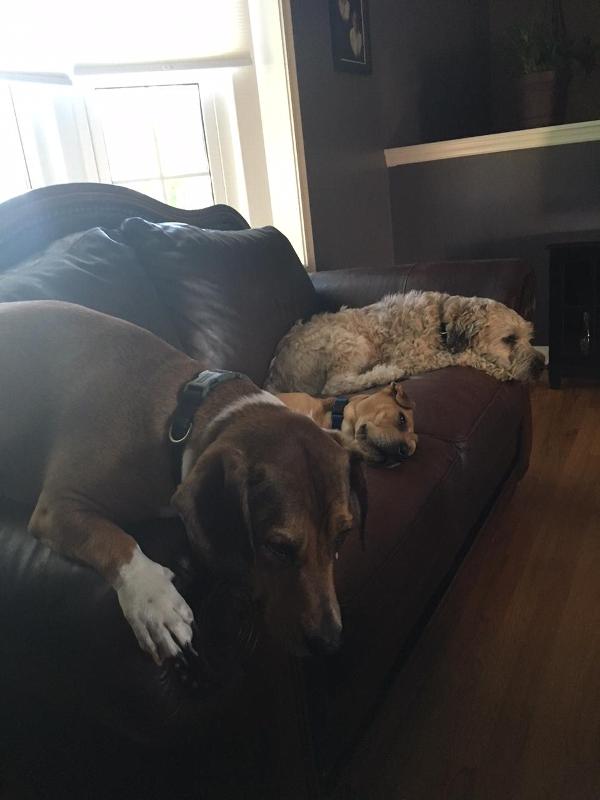
Find the location of a particular element. floor is located at coordinates (534, 546).